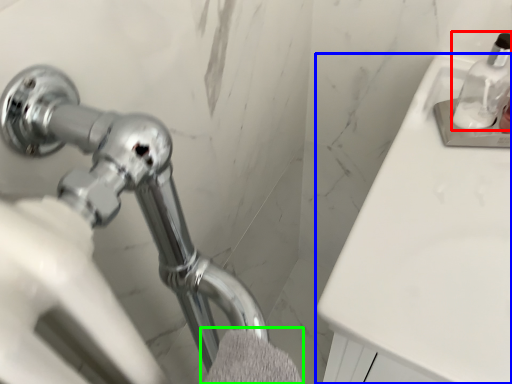
Question: Considering the real-world distances, which object is closest to soap dispenser (highlighted by a red box)? counter top (highlighted by a blue box) or bath towel (highlighted by a green box).

Choices:
 (A) counter top
 (B) bath towel

Answer: (A)